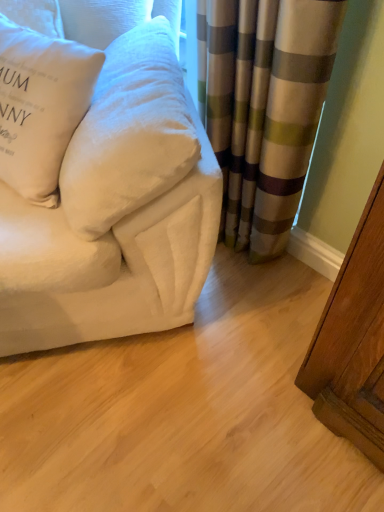
Question: Considering the positions of white velvety pillow at left, which appears as the 1th pillow when viewed from the right, and white velvety couch at upper left in the image, is white velvety pillow at left, which appears as the 1th pillow when viewed from the right, bigger or smaller than white velvety couch at upper left?

Choices:
 (A) big
 (B) small

Answer: (B)

Question: Considering the positions of white velvety pillow at left, positioned as the 2th pillow in left-to-right order, and white velvety couch at upper left in the image, is white velvety pillow at left, positioned as the 2th pillow in left-to-right order, wider or thinner than white velvety couch at upper left?

Choices:
 (A) thin
 (B) wide

Answer: (A)

Question: Estimate the real-world distances between objects in this image. Which object is farther from the white velvety couch at upper left?

Choices:
 (A) white soft pillow at upper left, which is the 1th pillow from left to right
 (B) white velvety pillow at left, positioned as the 2th pillow in left-to-right order
 (C) striped fabric curtain at center

Answer: (C)

Question: Which of these objects is positioned farthest from the white velvety couch at upper left?

Choices:
 (A) white velvety pillow at left, which appears as the 1th pillow when viewed from the right
 (B) white soft pillow at upper left, marked as the 2th pillow in a right-to-left arrangement
 (C) striped fabric curtain at center

Answer: (C)